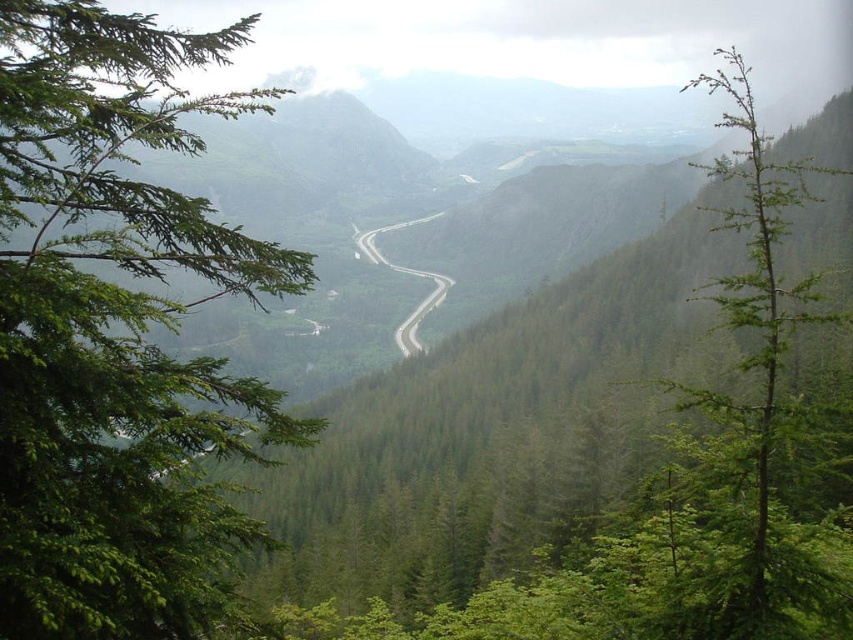
Question: Is green leafy tree at left to the right of green needle-like tree at right from the viewer's perspective?

Choices:
 (A) yes
 (B) no

Answer: (B)

Question: Is green leafy tree at left positioned behind green asphalt road at center?

Choices:
 (A) yes
 (B) no

Answer: (B)

Question: Based on their relative distances, which object is nearer to the green leafy tree at left?

Choices:
 (A) green needle-like tree at right
 (B) green asphalt road at center

Answer: (B)

Question: Among these points, which one is farthest from the camera?

Choices:
 (A) (189, 108)
 (B) (773, 557)

Answer: (A)

Question: Which of the following is the farthest from the observer?

Choices:
 (A) green leafy tree at left
 (B) green needle-like tree at right
 (C) green asphalt road at center

Answer: (C)

Question: From the image, what is the correct spatial relationship of green leafy tree at left in relation to green needle-like tree at right?

Choices:
 (A) left
 (B) right

Answer: (A)